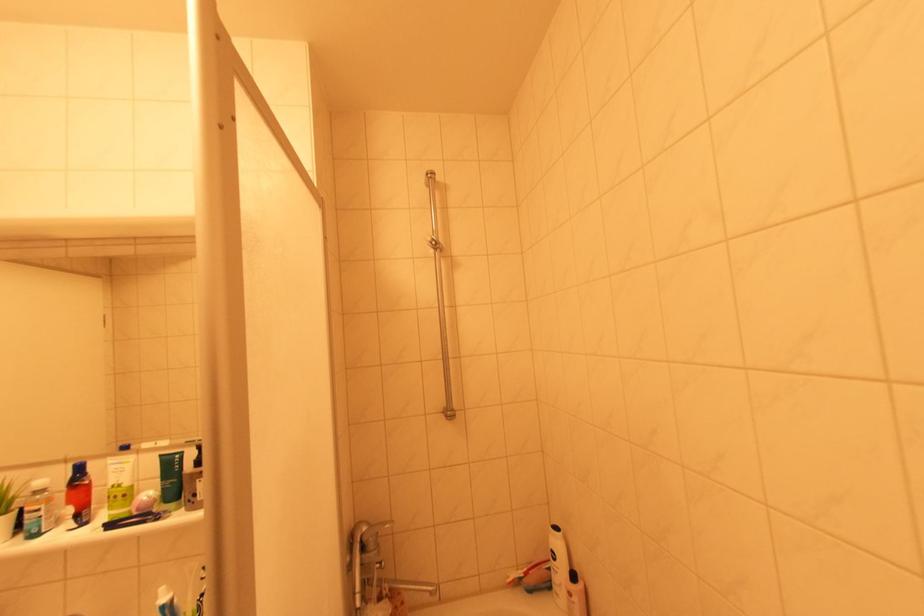
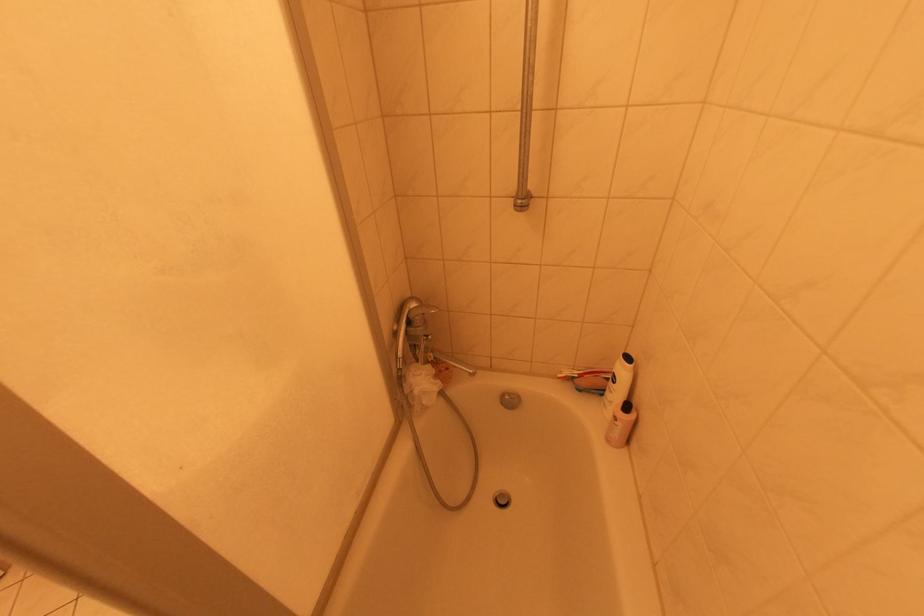
Based on the continuous images, in which direction is the camera rotating?

The camera's rotation is toward left-down.